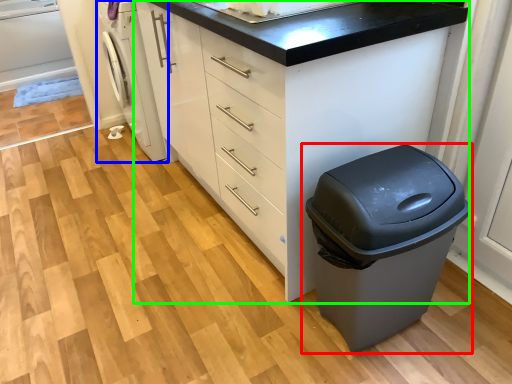
Question: Based on their relative distances, which object is farther from waste container (highlighted by a red box)? Choose from washing machine (highlighted by a blue box) and chest of drawers (highlighted by a green box).

Choices:
 (A) washing machine
 (B) chest of drawers

Answer: (A)